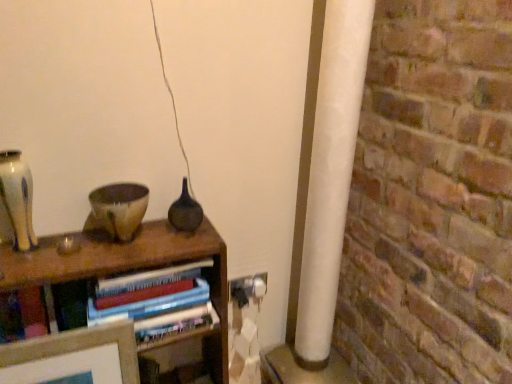
At what (x,y) coordinates should I click in order to perform the action: click on vacant space situated above hardcover books at center (from a real-world perspective). Please return your answer as a coordinate pair (x, y). This screenshot has height=384, width=512. Looking at the image, I should click on (103, 250).